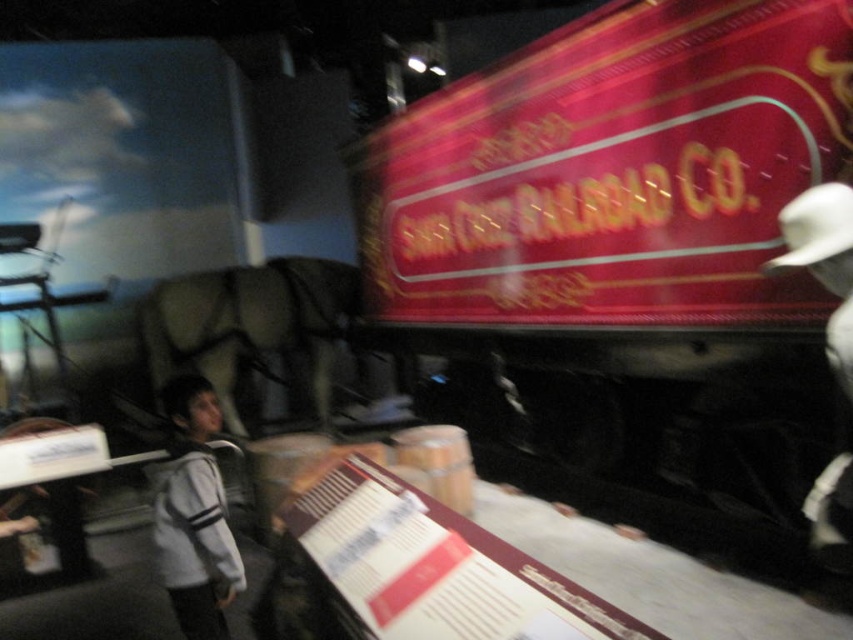
Question: Considering the real-world distances, which object is farthest from the shiny red metal train at upper right?

Choices:
 (A) gray fleece jacket at left
 (B) white felt hat at right

Answer: (A)

Question: Which of these objects is positioned farthest from the white matte cowboy hat at upper right?

Choices:
 (A) shiny red metal train at upper right
 (B) gray fleece jacket at left
 (C) white felt hat at right

Answer: (B)

Question: In this image, where is shiny red metal train at upper right located relative to white felt hat at right?

Choices:
 (A) above
 (B) below

Answer: (A)

Question: Which object is positioned closest to the gray fleece jacket at left?

Choices:
 (A) shiny red metal train at upper right
 (B) white matte cowboy hat at upper right

Answer: (B)

Question: Is gray fleece jacket at left thinner than white felt hat at right?

Choices:
 (A) no
 (B) yes

Answer: (A)

Question: Does white felt hat at right appear over white matte cowboy hat at upper right?

Choices:
 (A) yes
 (B) no

Answer: (B)